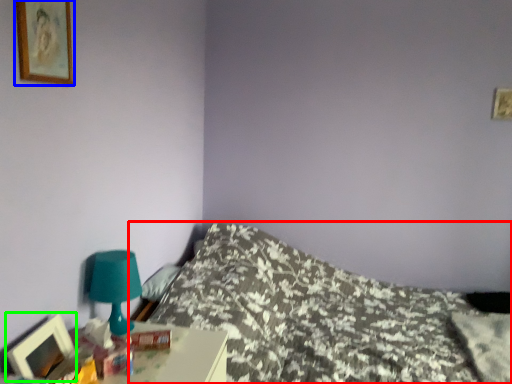
Question: Which is nearer to the bed (highlighted by a red box)? picture frame (highlighted by a blue box) or picture frame (highlighted by a green box).

Choices:
 (A) picture frame
 (B) picture frame

Answer: (B)